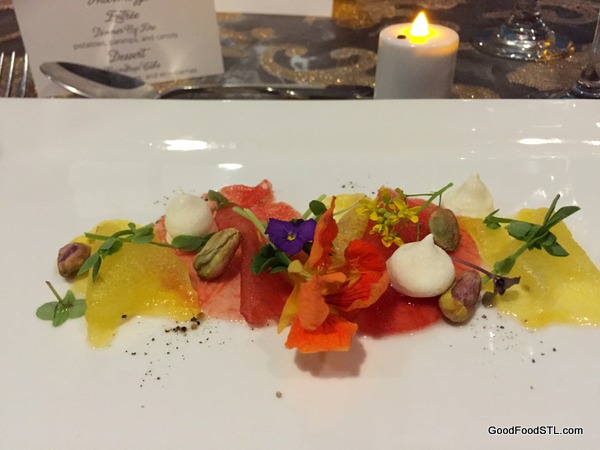
The height and width of the screenshot is (450, 600). Identify the location of spoon handle. (331, 87).